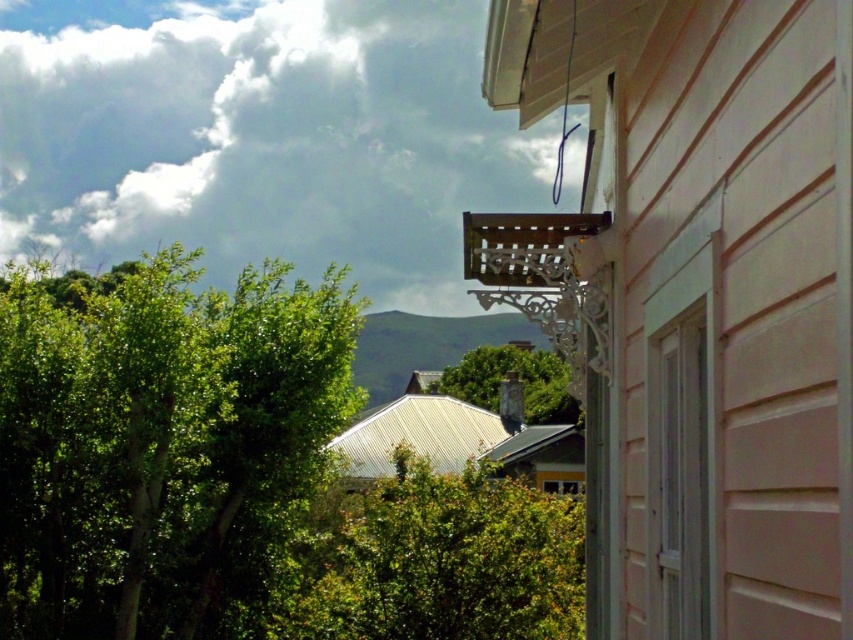
Question: Does white painted wood window at right have a lesser width compared to green leafy tree at center?

Choices:
 (A) yes
 (B) no

Answer: (A)

Question: Which of the following is the farthest from the observer?

Choices:
 (A) (616, 355)
 (B) (173, 314)
 (C) (473, 621)

Answer: (C)

Question: Does green leafy tree at left lie behind white painted wood window at right?

Choices:
 (A) yes
 (B) no

Answer: (A)

Question: Which of the following is the closest to the observer?

Choices:
 (A) (471, 352)
 (B) (350, 344)
 (C) (349, 552)

Answer: (B)

Question: Considering the relative positions of pink painted wood siding at right and white painted wood window at right in the image provided, where is pink painted wood siding at right located with respect to white painted wood window at right?

Choices:
 (A) below
 (B) above

Answer: (B)

Question: Which point is farther to the camera?

Choices:
 (A) green leafy tree at left
 (B) green leafy bush at center

Answer: (B)